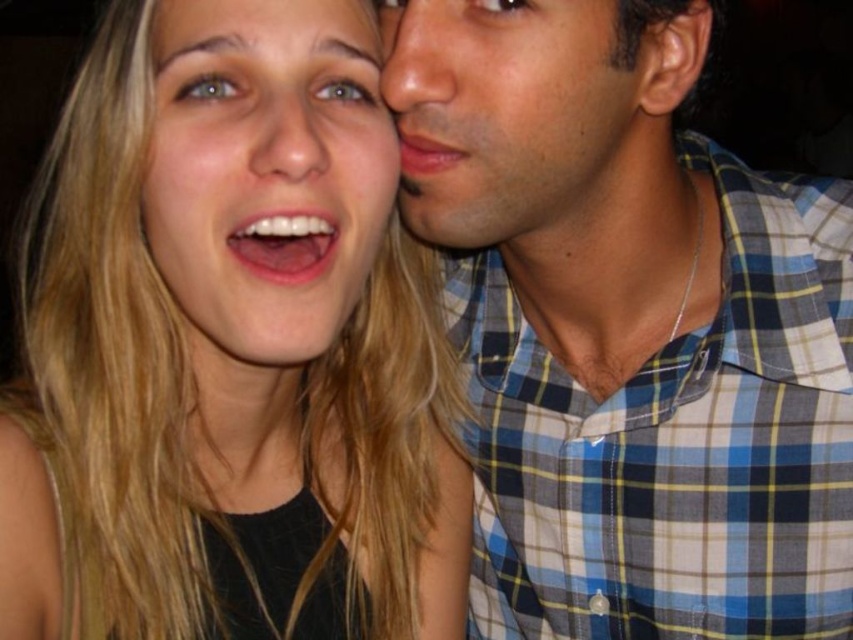
What is the significance of the point at coordinates (514, 124) in the image?

The point at coordinates (514, 124) marks the location of the smooth skin face at upper right.

You are a photographer adjusting the focus on a camera. You notice the white glossy teeth at center and the matte skin forehead at upper center in the frame. Which object should you focus on to ensure the subject is sharp and in focus?

The matte skin forehead at upper center should be focused on because it is positioned higher than the white glossy teeth at center, making it closer to the camera.

You are a photographer adjusting the focus on your camera. You need to ensure both the smooth skin face at upper right and the smooth skin nose at center are in focus. Which object should you adjust the focus for first based on their sizes?

The smooth skin face at upper right is bigger than the smooth skin nose at center, so you should adjust the focus for the smooth skin face at upper right first to ensure it is sharp and in focus.